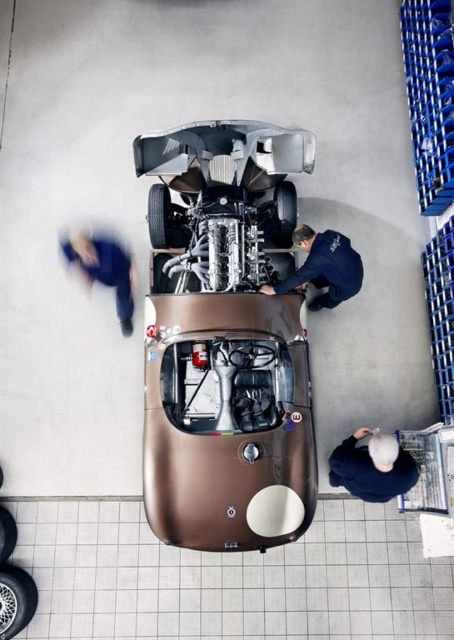
Does dark blue shirt at lower right have a lesser width compared to blue fabric jacket at upper left?

Indeed, dark blue shirt at lower right has a lesser width compared to blue fabric jacket at upper left.

Does dark blue shirt at lower right have a greater width compared to blue fabric jacket at upper left?

No.

Who is more forward, (376,486) or (94,260)?

Point (376,486) is more forward.

This screenshot has height=640, width=454. I want to click on dark blue shirt at lower right, so click(x=371, y=467).

Where is `dark blue uniform at center`? The height and width of the screenshot is (640, 454). dark blue uniform at center is located at coordinates (324, 268).

Measure the distance between dark blue uniform at center and camera.

dark blue uniform at center and camera are 16.33 feet apart.

Is point (340, 253) less distant than point (88, 276)?

Yes, it is in front of point (88, 276).

At what (x,y) coordinates should I click in order to perform the action: click on dark blue uniform at center. Please return your answer as a coordinate pair (x, y). Looking at the image, I should click on (324, 268).

Is shiny metallic race car at center wider than dark blue shirt at lower right?

Yes, shiny metallic race car at center is wider than dark blue shirt at lower right.

Is point (174, 472) more distant than point (410, 470)?

No, (174, 472) is closer to viewer.

The width and height of the screenshot is (454, 640). Find the location of `shiny metallic race car at center`. shiny metallic race car at center is located at coordinates (225, 339).